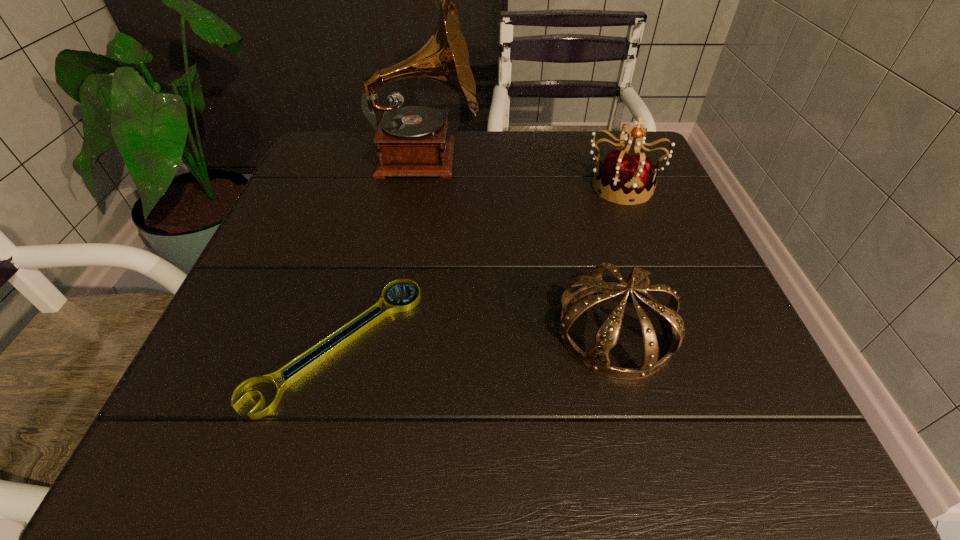
Locate an element on the screen. The height and width of the screenshot is (540, 960). the tallest object is located at coordinates (414, 142).

I want to click on the second tallest object, so click(x=626, y=178).

I want to click on the farther tiara, so click(626, 178).

I want to click on the second shortest object, so click(596, 359).

Locate an element on the screen. the nearer tiara is located at coordinates (596, 359).

Find the location of a particular element. The height and width of the screenshot is (540, 960). wrench is located at coordinates (296, 368).

The width and height of the screenshot is (960, 540). In order to click on free space located on the horn of the tallest object in this screenshot , I will do `click(559, 158)`.

Where is `vacant space located 0.350m on the front-facing side of the third shortest object`? Image resolution: width=960 pixels, height=540 pixels. vacant space located 0.350m on the front-facing side of the third shortest object is located at coordinates (684, 347).

Locate an element on the screen. This screenshot has height=540, width=960. free space located on the back of the nearer tiara is located at coordinates (593, 249).

Where is `vacant space located on the back of the wrench`? This screenshot has width=960, height=540. vacant space located on the back of the wrench is located at coordinates (382, 179).